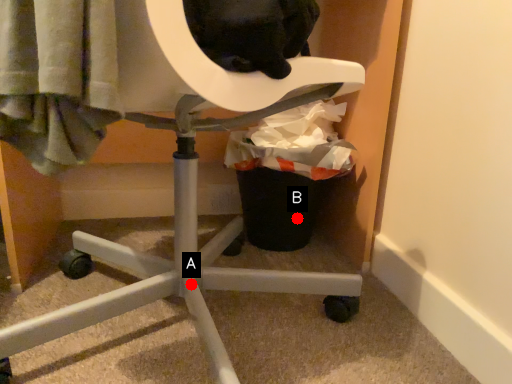
Question: Two points are circled on the image, labeled by A and B beside each circle. Which point is closer to the camera?

Choices:
 (A) A is closer
 (B) B is closer

Answer: (A)